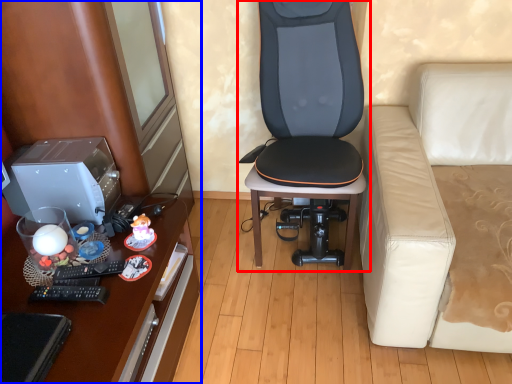
Question: Which of the following is the closest to the observer, chair (highlighted by a red box) or dresser (highlighted by a blue box)?

Choices:
 (A) chair
 (B) dresser

Answer: (B)